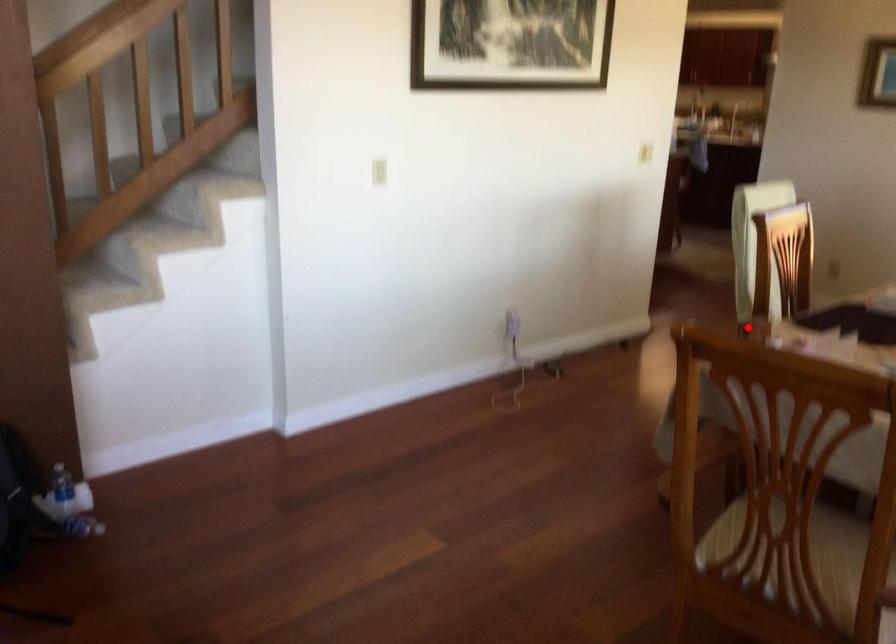
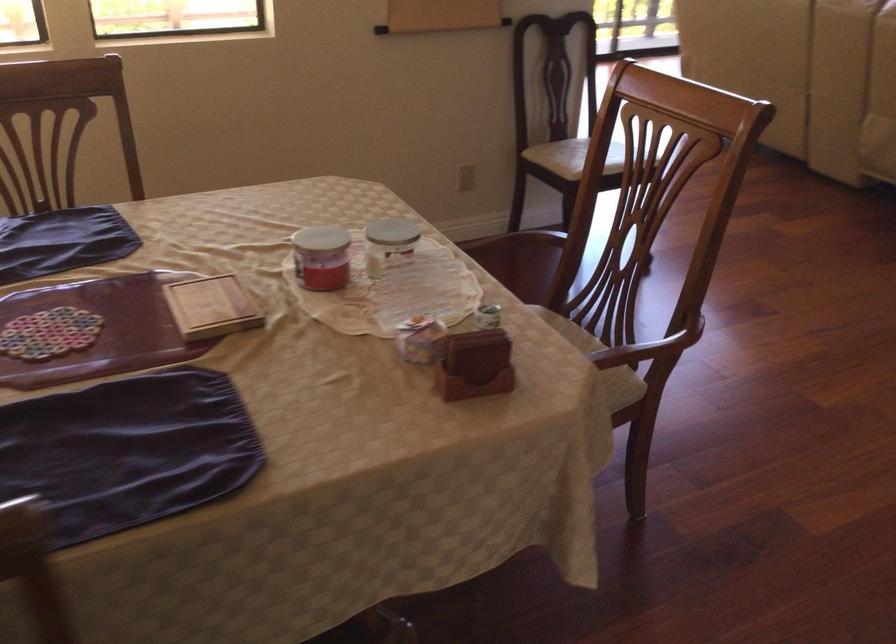
The point at the highlighted location is marked in the first image. Where is the corresponding point in the second image?

(475, 365)